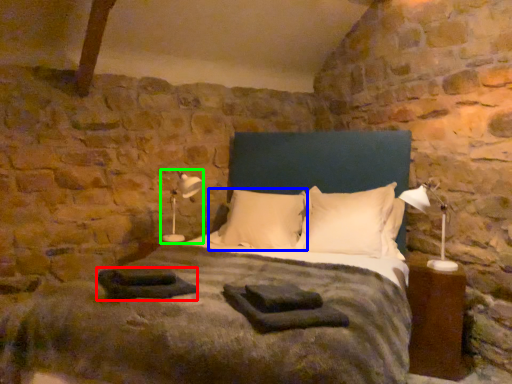
Question: Which object is the closest to the material (highlighted by a red box)? Choose among these: pillow (highlighted by a blue box) or table lamp (highlighted by a green box).

Choices:
 (A) pillow
 (B) table lamp

Answer: (A)